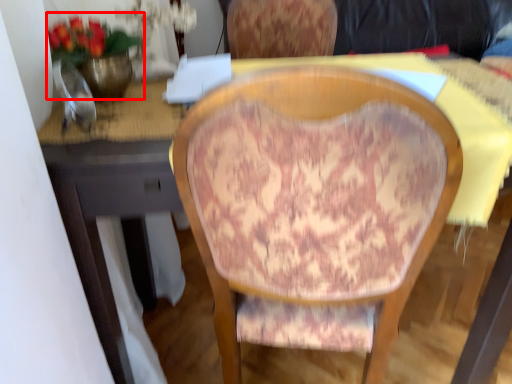
Question: Observing the image, what is the correct spatial positioning of floral arrangement (annotated by the red box) in reference to chair?

Choices:
 (A) left
 (B) right

Answer: (A)